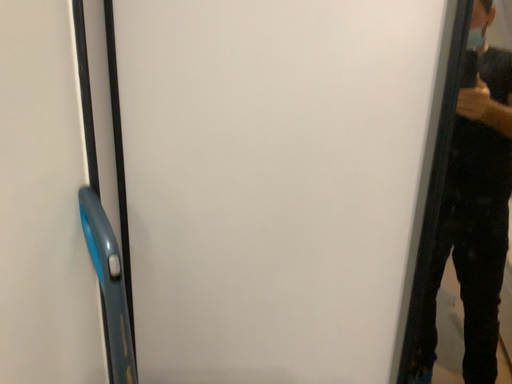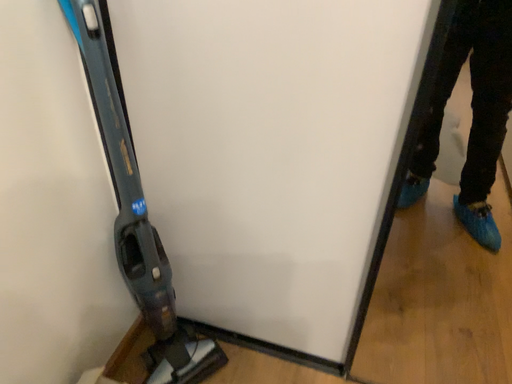
Question: Which way did the camera rotate in the video?

Choices:
 (A) rotated downward
 (B) rotated upward

Answer: (A)